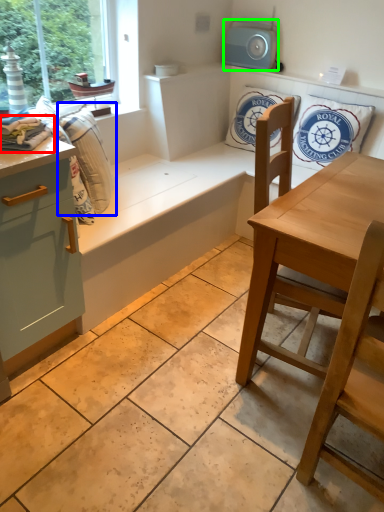
Question: Which object is positioned farthest from material (highlighted by a red box)? Select from laundry (highlighted by a blue box) and appliance (highlighted by a green box).

Choices:
 (A) laundry
 (B) appliance

Answer: (B)